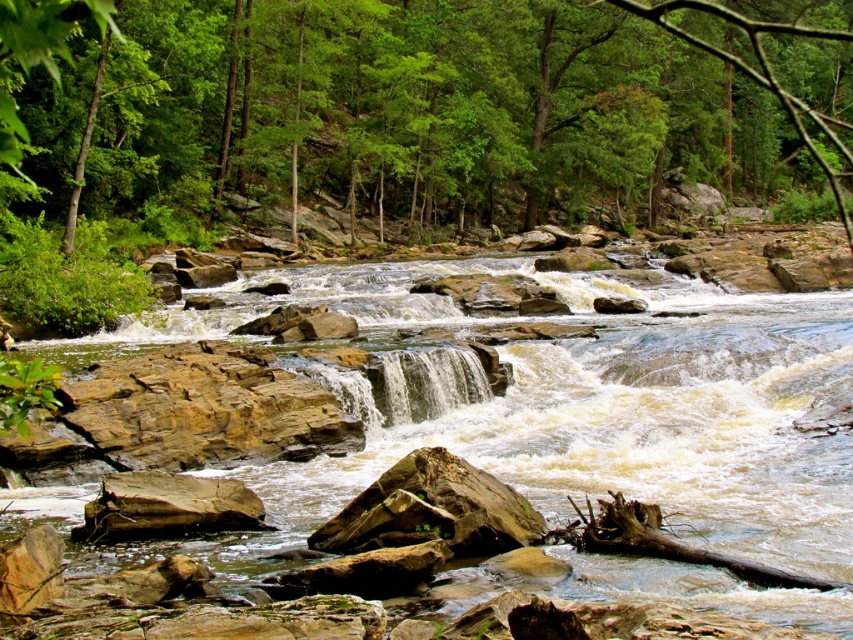
Is green leafy tree at upper center to the right of brown rocky stream at center from the viewer's perspective?

Indeed, green leafy tree at upper center is positioned on the right side of brown rocky stream at center.

Does green leafy tree at upper center appear over brown rocky stream at center?

Indeed, green leafy tree at upper center is positioned over brown rocky stream at center.

This screenshot has height=640, width=853. What do you see at coordinates (415, 104) in the screenshot?
I see `green leafy tree at upper center` at bounding box center [415, 104].

The height and width of the screenshot is (640, 853). In order to click on green leafy tree at upper center in this screenshot , I will do `click(415, 104)`.